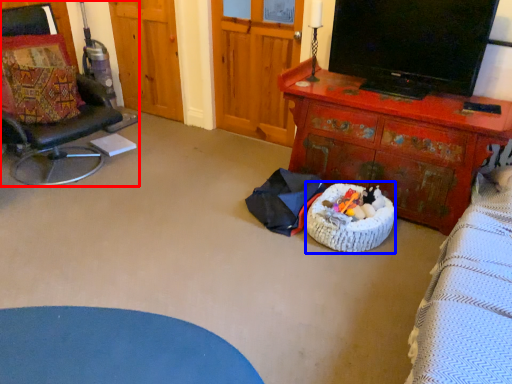
Question: Which object appears farthest to the camera in this image, chair (highlighted by a red box) or infant bed (highlighted by a blue box)?

Choices:
 (A) chair
 (B) infant bed

Answer: (B)